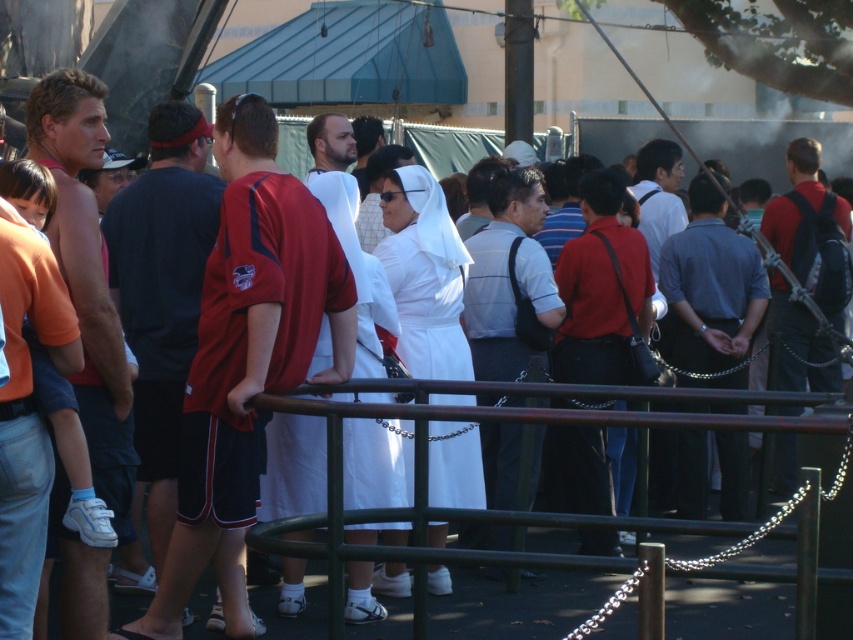
Can you confirm if green metal railing at center is positioned to the right of dark gray shirt at center?

Correct, you'll find green metal railing at center to the right of dark gray shirt at center.

Does green metal railing at center appear over dark gray shirt at center?

Incorrect, green metal railing at center is not positioned above dark gray shirt at center.

Does point (468, 518) lie behind point (535, 269)?

No, (468, 518) is closer to viewer.

I want to click on green metal railing at center, so click(490, 509).

Can you confirm if red fabric shirt at center is smaller than dark blue jersey at center?

Actually, red fabric shirt at center might be larger than dark blue jersey at center.

Does point (233, 147) come closer to viewer compared to point (111, 236)?

Yes, point (233, 147) is closer to viewer.

Who is more forward, (213, 362) or (151, 205)?

Point (213, 362) is in front.

Where is `red fabric shirt at center`? This screenshot has width=853, height=640. red fabric shirt at center is located at coordinates (247, 346).

Is red fabric shirt at center wider than dark gray shirt at center?

Indeed, red fabric shirt at center has a greater width compared to dark gray shirt at center.

From the picture: Does red fabric shirt at center have a lesser height compared to dark gray shirt at center?

No, red fabric shirt at center is not shorter than dark gray shirt at center.

This screenshot has width=853, height=640. Find the location of `red fabric shirt at center`. red fabric shirt at center is located at coordinates (247, 346).